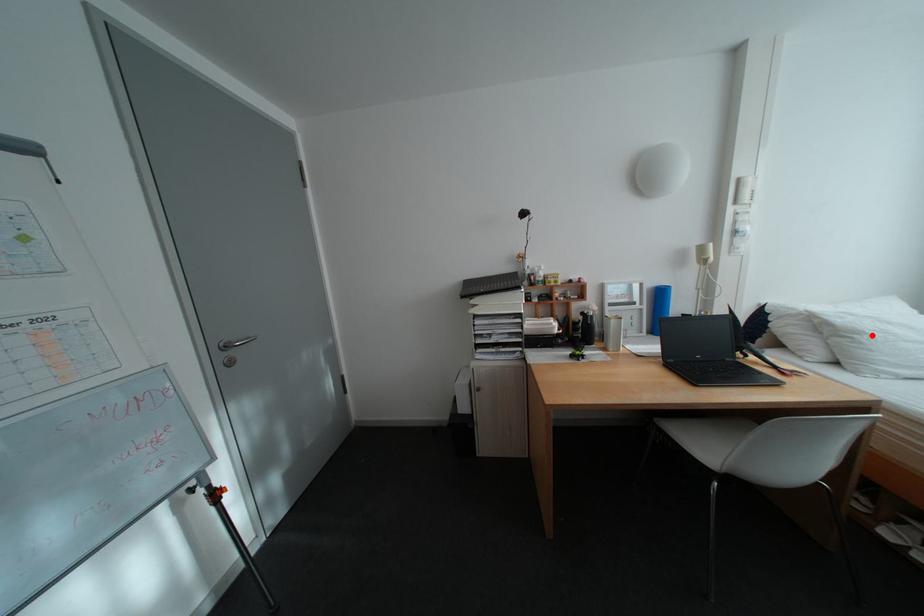
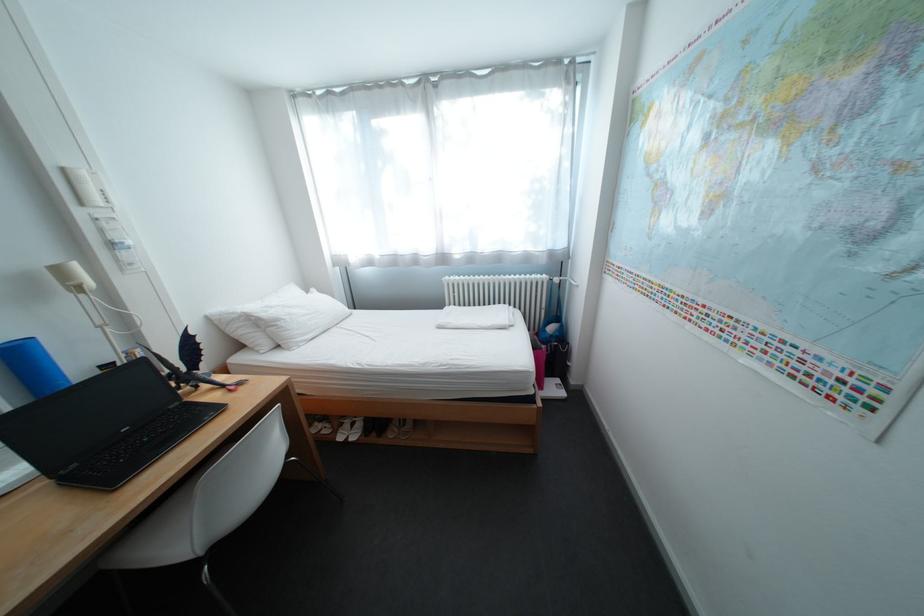
Locate, in the second image, the point that corresponds to the highlighted location in the first image.

(292, 322)